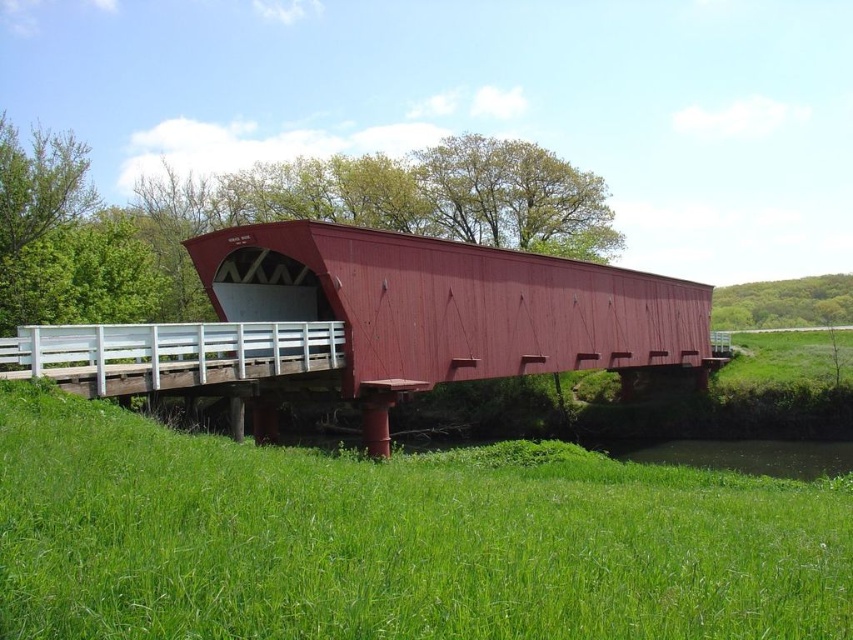
You are standing at the edge of the scene and want to place a small picnic basket on the green grassy at lower center. Based on the coordinates provided, can you confirm the exact 2D location where you should place the basket?

The green grassy at lower center is located at the 2D coordinates point (393, 540), so you should place the picnic basket there.

You are a painter setting up your easel to capture the rural scene. You want to ensure that the green grassy at lower center is visible in the foreground without being blocked by the matte red bridge at center. Is there enough space between them for this?

The green grassy at lower center is not as tall as the matte red bridge at center, so there should be enough space between them to ensure the grassy area remains visible in the foreground without being obscured by the bridge.

You are standing on the green grassy at lower center and want to cross to the other side of the matte red bridge at center. Which direction should you walk to reach the bridge first?

To reach the matte red bridge at center first, you should walk to the left since the green grassy at lower center is positioned to the right of the matte red bridge at center.